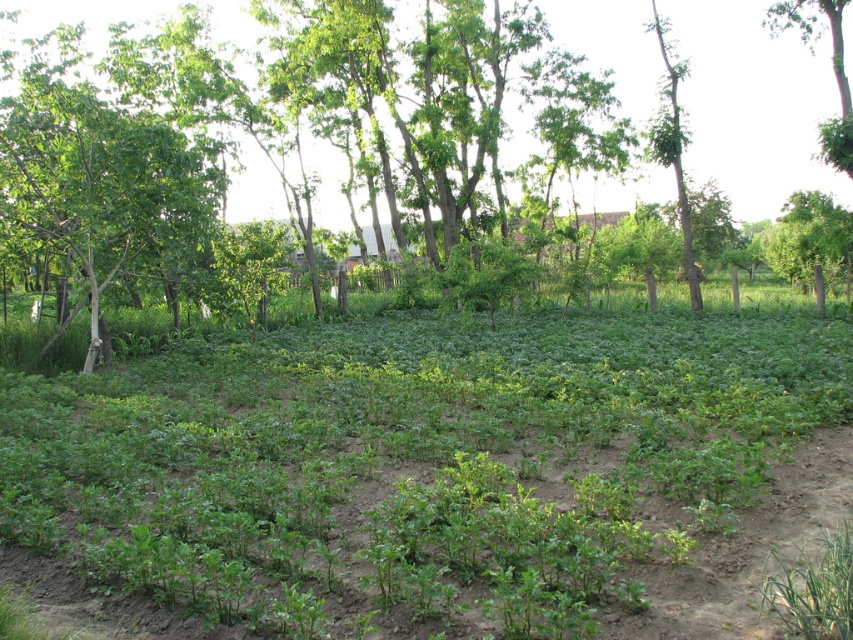
Is green leafy tree at center positioned at the back of green leafy tree at upper right?

Yes, green leafy tree at center is further from the viewer.

The width and height of the screenshot is (853, 640). What do you see at coordinates (753, 104) in the screenshot? I see `green leafy tree at center` at bounding box center [753, 104].

Which is behind, point (636, 54) or point (849, 93)?

The point (636, 54) is behind.

This screenshot has width=853, height=640. I want to click on green leafy tree at center, so click(753, 104).

Can you confirm if green leafy tree at upper right is wider than green rough bark tree at upper right?

Correct, the width of green leafy tree at upper right exceeds that of green rough bark tree at upper right.

Is point (820, 131) closer to viewer compared to point (675, 170)?

Yes, point (820, 131) is closer to viewer.

This screenshot has height=640, width=853. Describe the element at coordinates (833, 68) in the screenshot. I see `green leafy tree at upper right` at that location.

You are a GUI agent. You are given a task and a screenshot of the screen. Output one action in this format:
    pyautogui.click(x=<x>, y=<y>)
    Task: Click on the green leafy tree at upper right
    This screenshot has height=640, width=853.
    Given the screenshot: What is the action you would take?
    pyautogui.click(x=833, y=68)

Which is behind, point (769, 109) or point (682, 180)?

Positioned behind is point (769, 109).

Which of these two, green leafy tree at center or green rough bark tree at upper right, stands shorter?

Standing shorter between the two is green leafy tree at center.

Which is behind, point (740, 195) or point (675, 154)?

The point (740, 195) is behind.

Identify the location of green leafy tree at center. (753, 104).